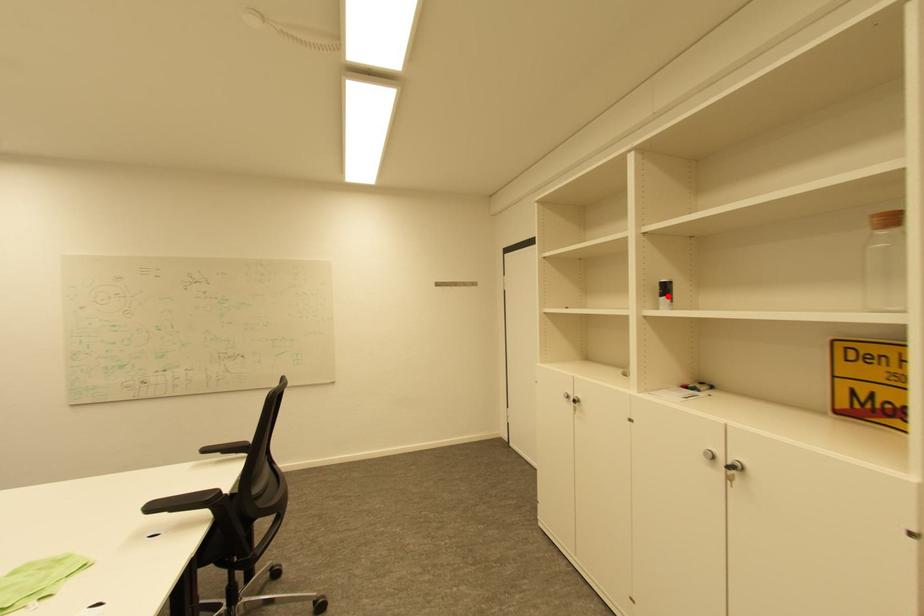
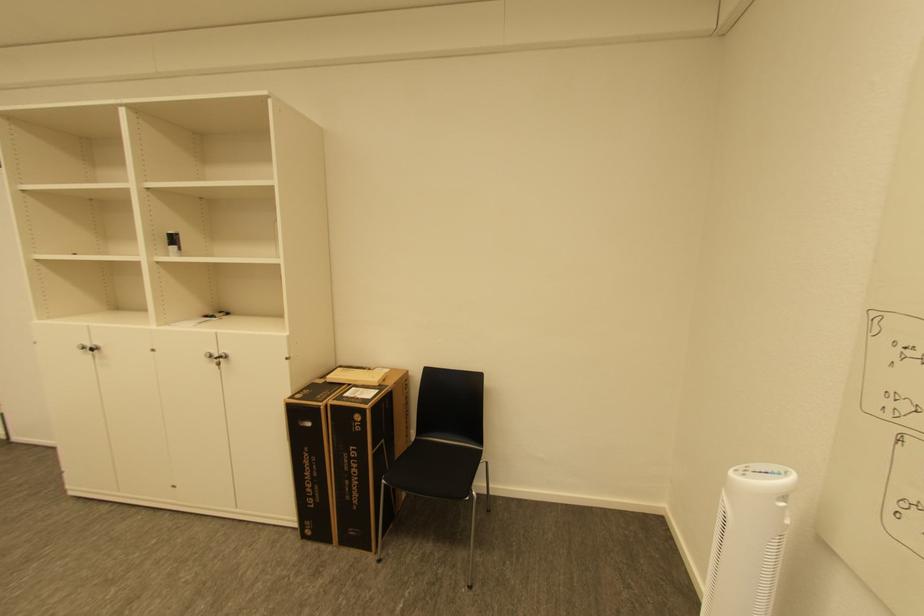
Find the pixel in the second image that matches the highlighted location in the first image.

(176, 245)